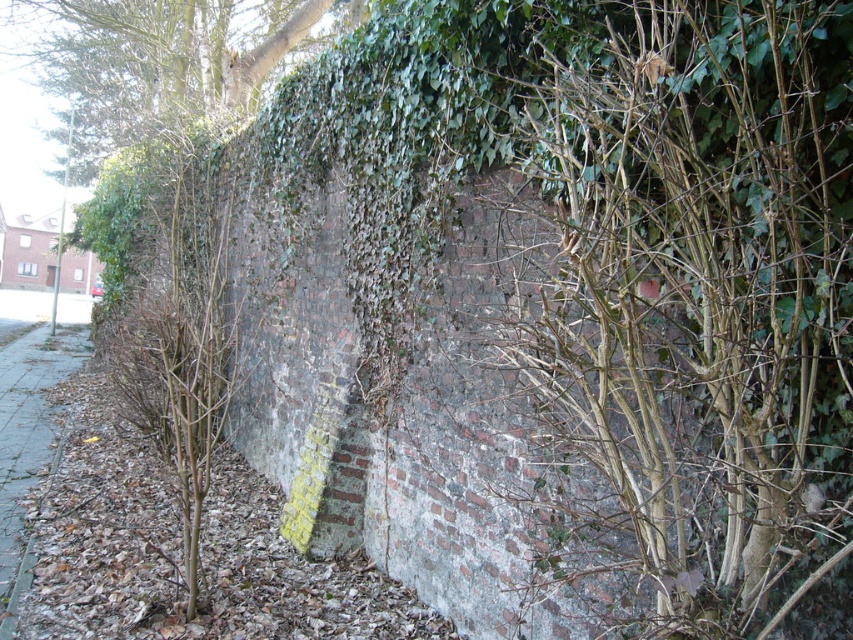
You are standing on the gray concrete pavement at lower left and looking towards the wall. Which direction should you walk to reach the bare branches at center?

You should walk to the right to reach the bare branches at center since they are located to the right of the gray concrete pavement at lower left.

You are standing in front of the weathered brick wall and see the point marked at coordinates (167, 58). What object does this point indicate?

The point at (167, 58) indicates the location of the green leafy tree at upper left.

You are a gardener who wants to plant a new shrub between the green leafy tree at upper left and the gray concrete pavement at lower left. The shrub requires a minimum of 3 meters of space to grow properly. Based on the scene, is there enough space between them for the shrub?

The distance between the green leafy tree at upper left and the gray concrete pavement at lower left is 5.31 meters, which is more than the required 3 meters. Therefore, there is enough space for the shrub to grow properly.